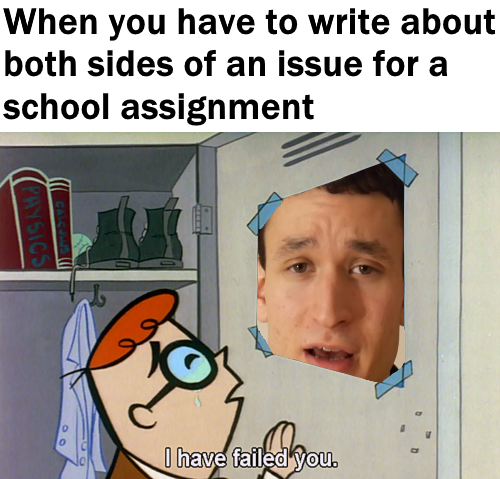
This screenshot has width=500, height=479. I want to click on red book, so click(20, 243).